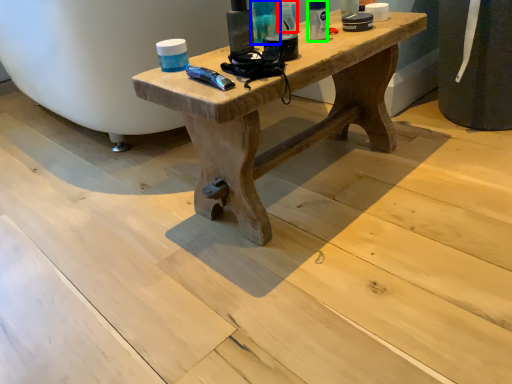
Question: Considering the real-world distances, which object is closest to toiletry (highlighted by a red box)? toiletry (highlighted by a blue box) or toiletry (highlighted by a green box).

Choices:
 (A) toiletry
 (B) toiletry

Answer: (A)